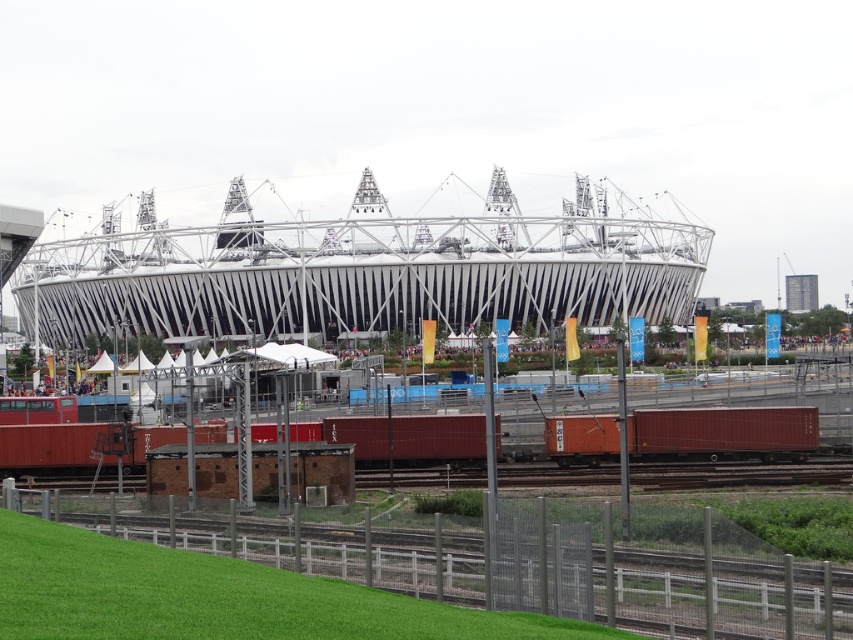
You are standing at the base of the stadium and want to walk to the orange matte container at center. Which direction should you move relative to the green grass at lower left?

Since the green grass at lower left is closer to the viewer than the orange matte container at center, you should move away from the green grass at lower left to reach the orange matte container at center.

You are standing at the entrance of the stadium and want to walk towards the orange matte container at center. There is green grass at lower left between you and the container. Can you walk through the grass to reach the container?

The green grass at lower left has a lesser width compared to orange matte container at center, so it is narrower than the container. Since the grass is between you and the container, you can walk through the grass to reach the orange matte container at center.

You are standing at the entrance of the stadium and want to walk to the orange matte container at center. Which direction should you head relative to the green grass at lower left?

To reach the orange matte container at center from the entrance, you should head to the right of the green grass at lower left since the green grass at lower left is located to the left of the orange matte container at center.